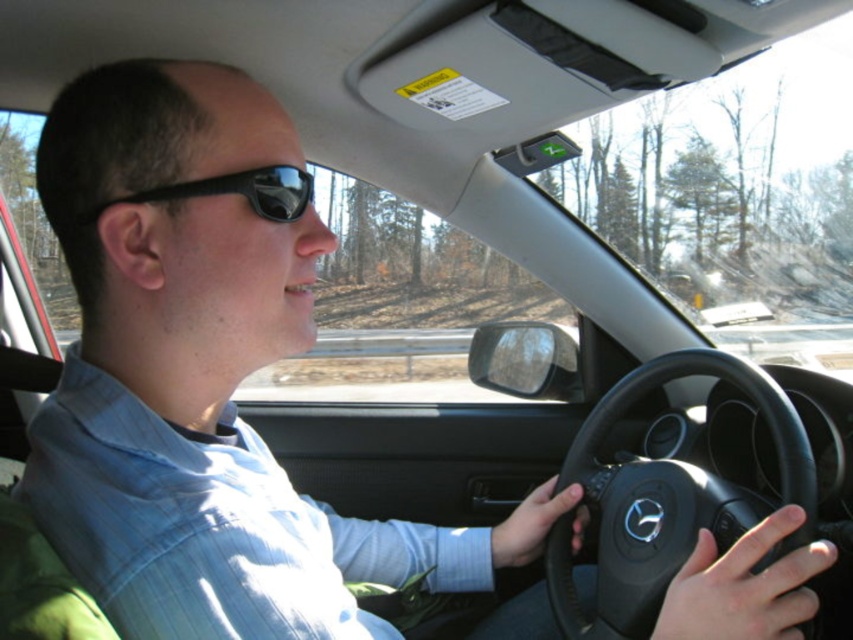
You are a passenger in the car and want to hand the driver a map. The map is currently on the dashboard. Which object, the black leather steering wheel at center or the black matte sunglasses at upper center, is closer to your right hand when reaching from the passenger seat?

The black leather steering wheel at center is positioned on the right side of the black matte sunglasses at upper center, so when reaching from the passenger seat, the black leather steering wheel at center would be closer to your right hand.

You are a passenger in the car and want to know if the black leather steering wheel at center can block your view of the black matte sunglasses at upper center. Based on their sizes, can the steering wheel at center block the sunglasses at upper center?

The black leather steering wheel at center is wider than the black matte sunglasses at upper center, so it can block the view of the sunglasses at upper center if positioned between the passenger and the sunglasses.

You are a passenger in a car and want to know if the driver is looking at the road ahead. Based on the positions of the black leather steering wheel at center and the black matte sunglasses at upper center, can you determine if the driver is looking forward?

The black leather steering wheel at center is positioned under the black matte sunglasses at upper center. This suggests that the driver is looking forward, as the sunglasses are above the steering wheel, indicating the driver is facing the windshield where the road is visible.